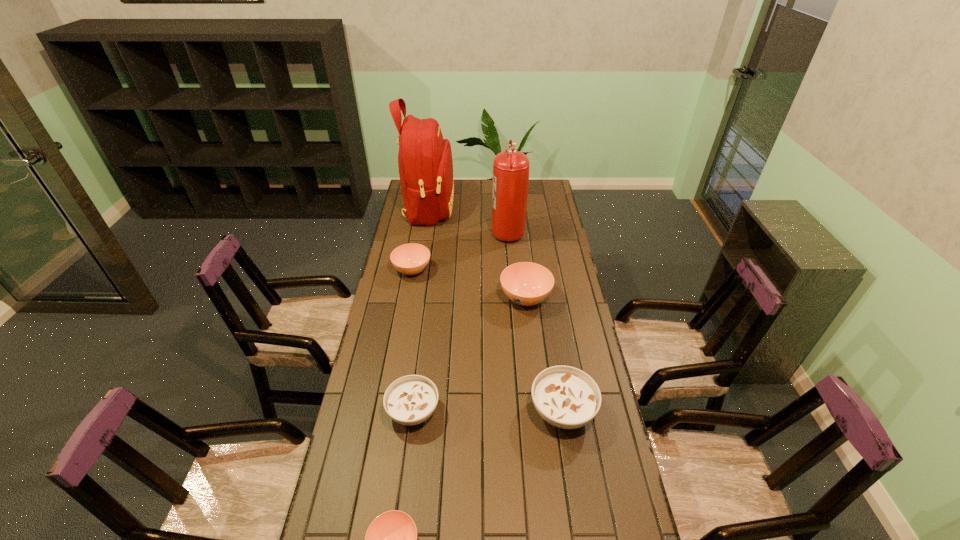
The image size is (960, 540). What are the coordinates of `pink backpack` in the screenshot? It's located at click(x=425, y=163).

Identify the location of red fire extinguisher. (510, 182).

Find the location of a particular element. the biggest peach soup bowl is located at coordinates (525, 283).

What are the coordinates of `the bigger white soup bowl` in the screenshot? It's located at (566, 397).

At what (x,y) coordinates should I click in order to perform the action: click on the second smallest peach soup bowl. Please return your answer as a coordinate pair (x, y). Image resolution: width=960 pixels, height=540 pixels. Looking at the image, I should click on (409, 259).

Identify the location of the left white soup bowl. (410, 400).

Locate an element on the screen. free space located 0.130m on the front-facing side of the pink backpack is located at coordinates (480, 207).

Where is `vacant space situated on the instruction side of the red fire extinguisher`? The image size is (960, 540). vacant space situated on the instruction side of the red fire extinguisher is located at coordinates (470, 230).

At what (x,y) coordinates should I click in order to perform the action: click on vacant area situated on the instruction side of the red fire extinguisher. Please return your answer as a coordinate pair (x, y). This screenshot has width=960, height=540. Looking at the image, I should click on (432, 230).

Identify the location of vacant space situated 0.200m on the instruction side of the red fire extinguisher. This screenshot has width=960, height=540. (450, 230).